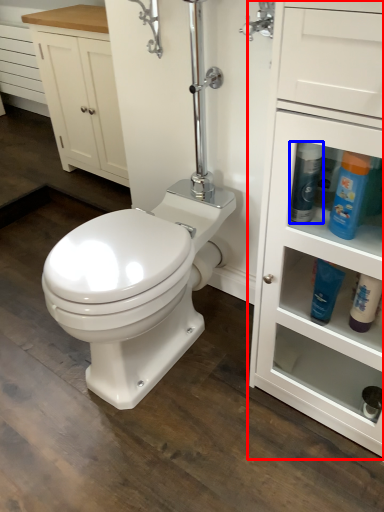
Question: Which point is closer to the camera, bathroom cabinet (highlighted by a red box) or cleaning product (highlighted by a blue box)?

Choices:
 (A) bathroom cabinet
 (B) cleaning product

Answer: (A)